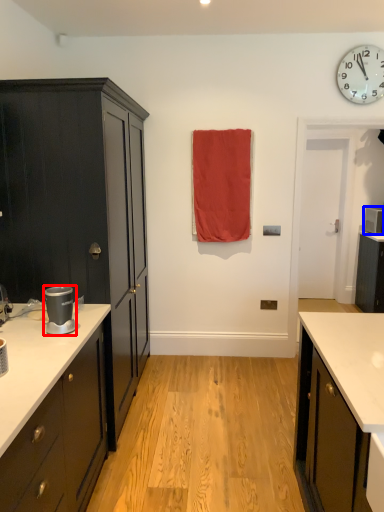
Question: Which object appears closest to the camera in this image, appliance (highlighted by a red box) or appliance (highlighted by a blue box)?

Choices:
 (A) appliance
 (B) appliance

Answer: (A)